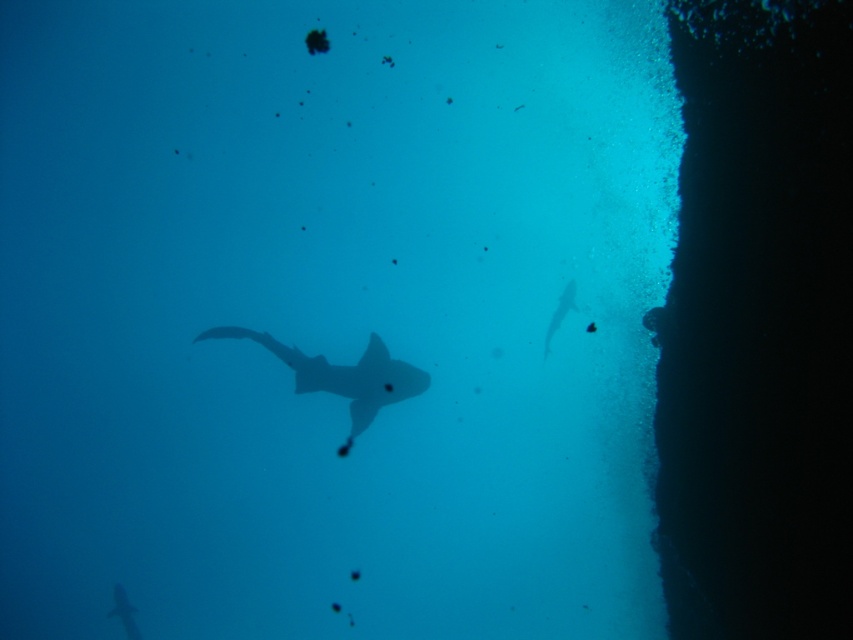
You are a diver swimming underwater and see the translucent gray shark at center and the translucent gray fish at right. You want to reach the fish without getting too close to the shark. Can you safely swim between them if you need to stay at least 7 feet away from the shark?

The translucent gray shark at center is 6.51 feet away from the translucent gray fish at right. Since you need to stay at least 7 feet away from the shark, the distance between them is insufficient, so you cannot safely swim between them without getting too close to the shark.

You are a diver swimming underwater and see a shark. You need to move to a safe distance of at least 10 meters away from the shark. Your current position is at point (x=403, y=396). Is your current position safe?

The distance between your current position at point (x=403, y=396) and the shark is 8.51 meters, which is less than the required 10 meters. Therefore, your current position is not safe.